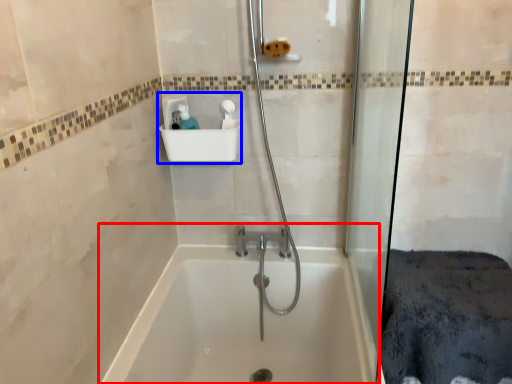
Question: Which point is further to the camera, bathtub (highlighted by a red box) or sink (highlighted by a blue box)?

Choices:
 (A) bathtub
 (B) sink

Answer: (B)